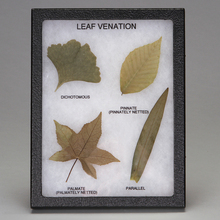
Locate an element on the screen. black frame is located at coordinates point(41,11).